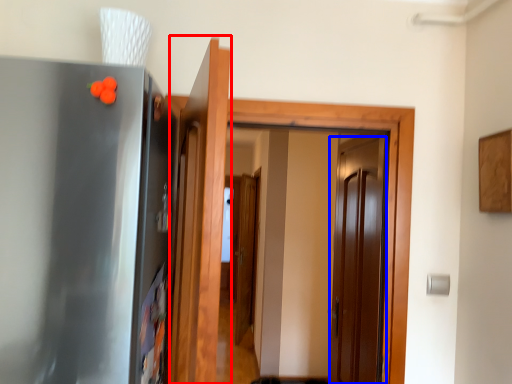
Question: Which object appears closest to the camera in this image, door (highlighted by a red box) or door (highlighted by a blue box)?

Choices:
 (A) door
 (B) door

Answer: (A)